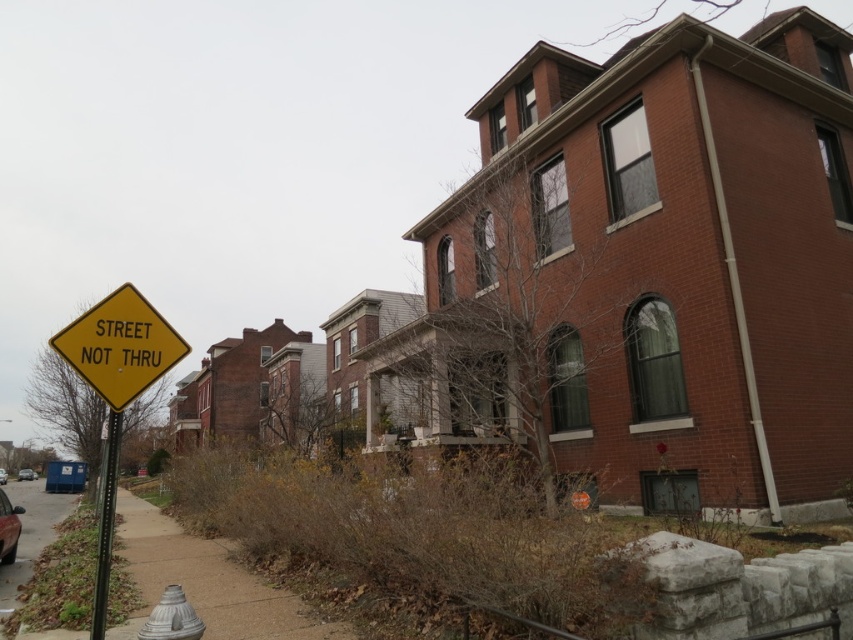
You are standing at the point labeled as point (30, 534) which is the concrete sidewalk at lower left. You want to walk to the yellow diamond sign mounted on a black pole. Which direction should you head?

The concrete sidewalk at lower left is at point (30, 534). The yellow diamond sign mounted on a black pole is located in the foreground, so you should head towards the foreground direction to reach it.

You are a delivery driver approaching the residential street and see the yellow matte street sign at lower left. According to the coordinates provided, where exactly is the yellow matte street sign positioned in relation to the other elements in the scene?

The yellow matte street sign at lower left is located at point 0.542 on the x axis and 0.141 on the y axis, which places it in the lower left portion of the scene.

You are a delivery person trying to park your delivery van on the street. You see the concrete sidewalk at lower left and the matte black car at lower left. Which object is closer to the ground?

The matte black car at lower left is closer to the ground because the concrete sidewalk at lower left is above it.